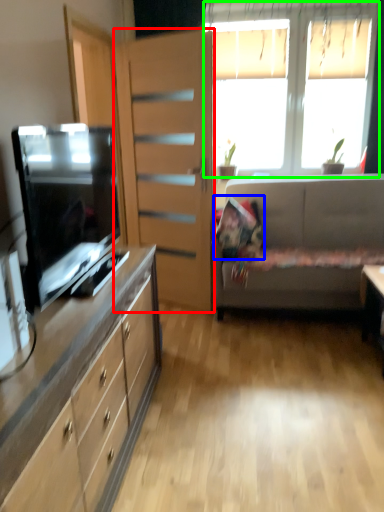
Question: Considering the real-world distances, which object is farthest from file cabinet (highlighted by a red box)? pillow (highlighted by a blue box) or window (highlighted by a green box)?

Choices:
 (A) pillow
 (B) window

Answer: (B)